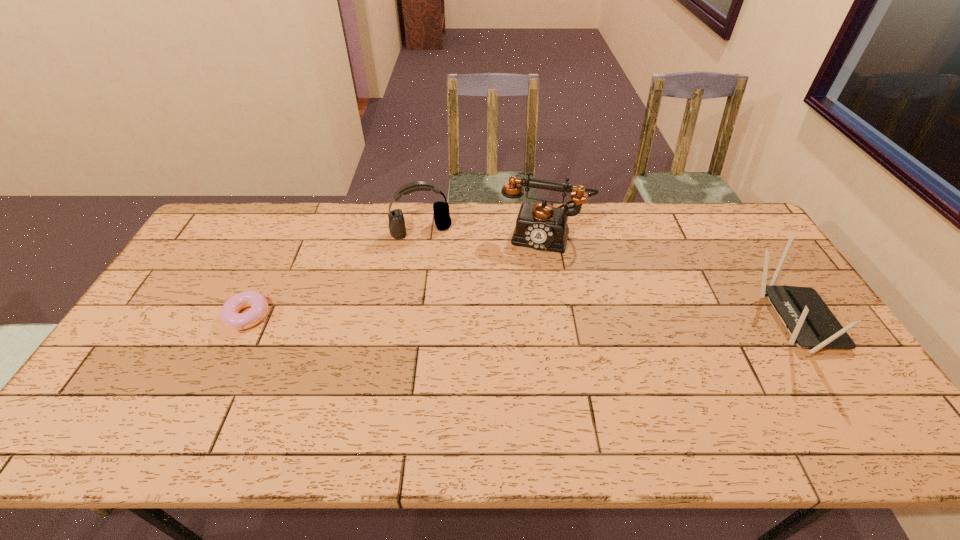
You are a GUI agent. You are given a task and a screenshot of the screen. Output one action in this format:
    pyautogui.click(x=<x>, y=<y>)
    Task: Click on the shortest object
    The image size is (960, 540).
    Given the screenshot: What is the action you would take?
    pyautogui.click(x=229, y=314)

Where is `doughnut`? This screenshot has width=960, height=540. doughnut is located at coordinates (229, 314).

Image resolution: width=960 pixels, height=540 pixels. Find the location of `router`. router is located at coordinates (811, 324).

Identify the location of the second object from right to left. Image resolution: width=960 pixels, height=540 pixels. (540, 226).

The width and height of the screenshot is (960, 540). What are the coordinates of `the tallest object` in the screenshot? It's located at (540, 226).

Image resolution: width=960 pixels, height=540 pixels. Identify the location of headset. (397, 229).

You are a GUI agent. You are given a task and a screenshot of the screen. Output one action in this format:
    pyautogui.click(x=<x>, y=<y>)
    Task: Click on the free space located on the back of the doughnut
    
    Given the screenshot: What is the action you would take?
    pyautogui.click(x=276, y=258)

Locate an element on the screen. vacant space situated on the front of the third object from left to right at the rotary dial is located at coordinates [x=522, y=304].

This screenshot has width=960, height=540. In order to click on free spot located on the front of the third object from left to right at the rotary dial in this screenshot , I will do `click(531, 272)`.

Where is `free point located 0.110m on the front of the third object from left to right at the rotary dial`? This screenshot has height=540, width=960. free point located 0.110m on the front of the third object from left to right at the rotary dial is located at coordinates (529, 276).